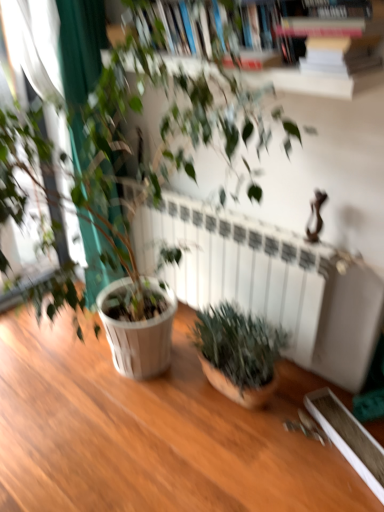
Question: Is wooden bookcase at upper center bigger or smaller than white matte radiator at center?

Choices:
 (A) small
 (B) big

Answer: (A)

Question: Considering the positions of wooden bookcase at upper center and white matte radiator at center in the image, is wooden bookcase at upper center wider or thinner than white matte radiator at center?

Choices:
 (A) wide
 (B) thin

Answer: (A)

Question: Which object is positioned farthest from the green matte plant at lower right, positioned as the 1th houseplant in bottom-to-top order?

Choices:
 (A) wooden bookcase at upper center
 (B) white matte radiator at center
 (C) green matte plant at center, acting as the second houseplant starting from the bottom

Answer: (A)

Question: Which object is positioned farthest from the white matte radiator at center?

Choices:
 (A) wooden bookcase at upper center
 (B) green matte plant at lower right, the second houseplant from the top
 (C) green matte plant at center, which is the 1th houseplant in top-to-bottom order

Answer: (A)